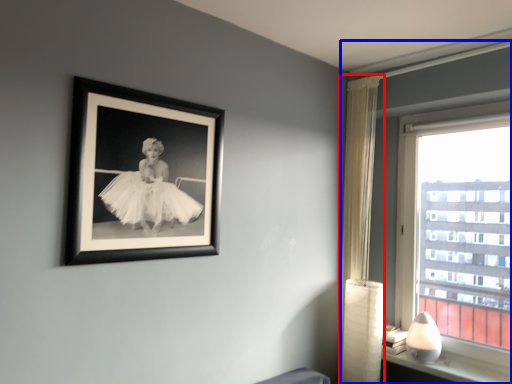
Question: Among these objects, which one is nearest to the camera, curtain (highlighted by a red box) or window (highlighted by a blue box)?

Choices:
 (A) curtain
 (B) window

Answer: (B)